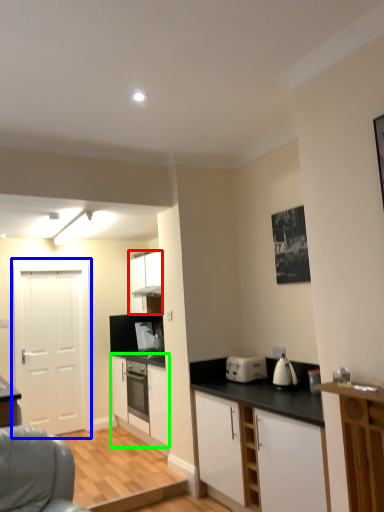
Question: Based on their relative distances, which object is nearer to cabinetry (highlighted by a red box)? Choose from door (highlighted by a blue box) and cabinetry (highlighted by a green box).

Choices:
 (A) door
 (B) cabinetry

Answer: (B)